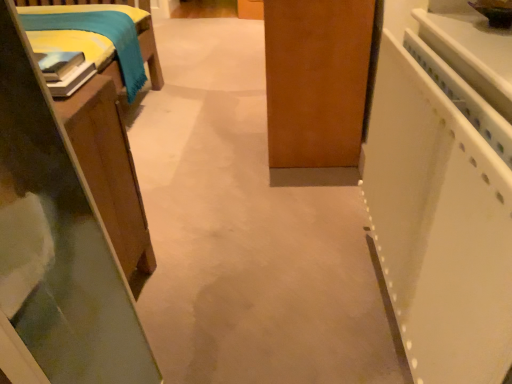
Question: Considering the relative sizes of white glossy counter top at right and wooden bed frame at left, the 1th furniture viewed from the top, in the image provided, is white glossy counter top at right wider than wooden bed frame at left, the 1th furniture viewed from the top,?

Choices:
 (A) no
 (B) yes

Answer: (B)

Question: Is white glossy counter top at right closer to camera compared to wooden bed frame at left, the 1th furniture viewed from the top?

Choices:
 (A) no
 (B) yes

Answer: (B)

Question: Considering the relative sizes of white glossy counter top at right and wooden bed frame at left, the second furniture from the bottom, in the image provided, is white glossy counter top at right taller than wooden bed frame at left, the second furniture from the bottom,?

Choices:
 (A) yes
 (B) no

Answer: (B)

Question: Can you confirm if white glossy counter top at right is bigger than wooden bed frame at left, the second furniture from the bottom?

Choices:
 (A) yes
 (B) no

Answer: (A)

Question: Is the surface of white glossy counter top at right in direct contact with wooden bed frame at left, the 1th furniture viewed from the top?

Choices:
 (A) no
 (B) yes

Answer: (A)

Question: In terms of height, does white glossy counter top at right look taller or shorter compared to wooden table at left, which is counted as the 2th furniture, starting from the top?

Choices:
 (A) tall
 (B) short

Answer: (B)

Question: From the image's perspective, is white glossy counter top at right positioned above or below wooden table at left, which is counted as the 2th furniture, starting from the top?

Choices:
 (A) below
 (B) above

Answer: (B)

Question: Is point (479, 59) closer or farther from the camera than point (32, 210)?

Choices:
 (A) closer
 (B) farther

Answer: (B)

Question: Would you say white glossy counter top at right is to the left or to the right of wooden table at left, which is counted as the 2th furniture, starting from the top, in the picture?

Choices:
 (A) left
 (B) right

Answer: (B)

Question: Is point (475, 360) positioned closer to the camera than point (0, 291)?

Choices:
 (A) farther
 (B) closer

Answer: (A)

Question: Relative to wooden table at left, positioned as the first furniture in bottom-to-top order, is white plastic cabinet at right in front or behind?

Choices:
 (A) behind
 (B) front

Answer: (B)

Question: From a real-world perspective, is white plastic cabinet at right positioned above or below wooden table at left, which is counted as the 2th furniture, starting from the top?

Choices:
 (A) below
 (B) above

Answer: (B)

Question: Considering the positions of white plastic cabinet at right and wooden table at left, positioned as the first furniture in bottom-to-top order, in the image, is white plastic cabinet at right wider or thinner than wooden table at left, positioned as the first furniture in bottom-to-top order,?

Choices:
 (A) wide
 (B) thin

Answer: (B)

Question: Considering their positions, is white plastic cabinet at right located in front of or behind wooden bed frame at left, the 1th furniture viewed from the top?

Choices:
 (A) behind
 (B) front

Answer: (B)

Question: From a real-world perspective, is white plastic cabinet at right positioned above or below wooden bed frame at left, the 1th furniture viewed from the top?

Choices:
 (A) below
 (B) above

Answer: (A)